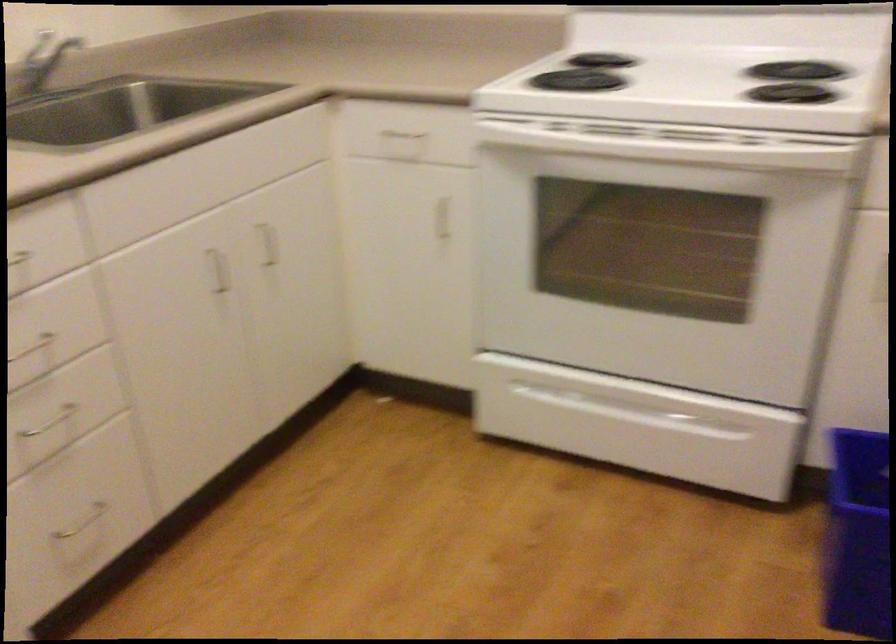
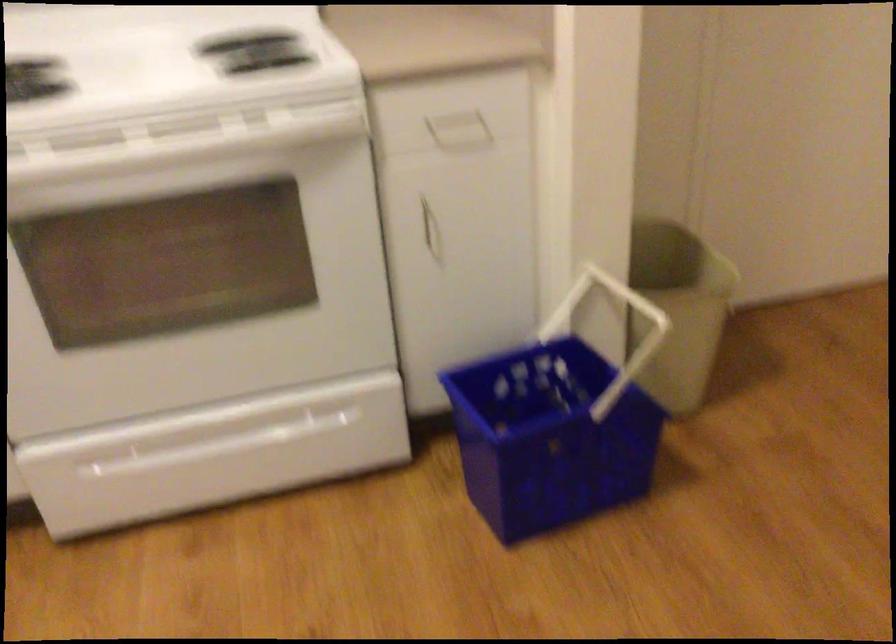
Locate, in the second image, the point that corresponds to the point at 629,412 in the first image.

(233, 440)